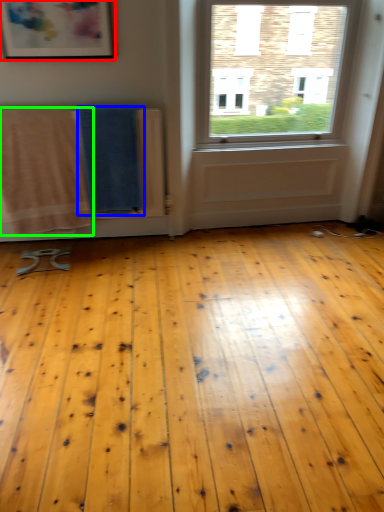
Question: Considering the real-world distances, which object is closest to picture frame (highlighted by a red box)? beach towel (highlighted by a blue box) or beach towel (highlighted by a green box).

Choices:
 (A) beach towel
 (B) beach towel

Answer: (A)